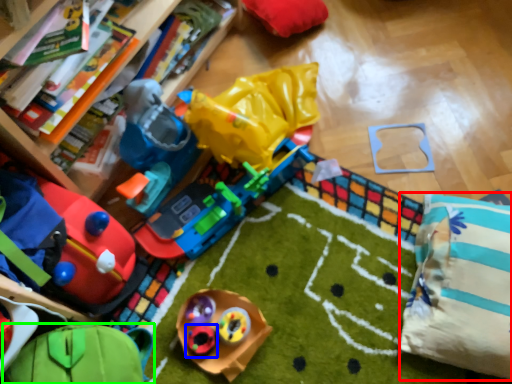
Question: Considering the real-world distances, which object is farthest from pillow (highlighted by a red box)? toy (highlighted by a blue box) or toy (highlighted by a green box)?

Choices:
 (A) toy
 (B) toy

Answer: (B)